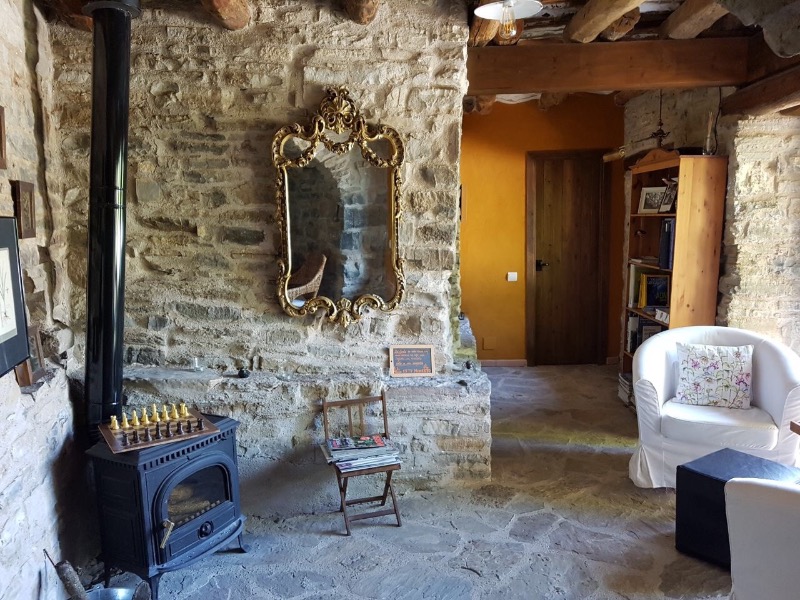
Where is `wooden door`? The width and height of the screenshot is (800, 600). wooden door is located at coordinates (573, 258).